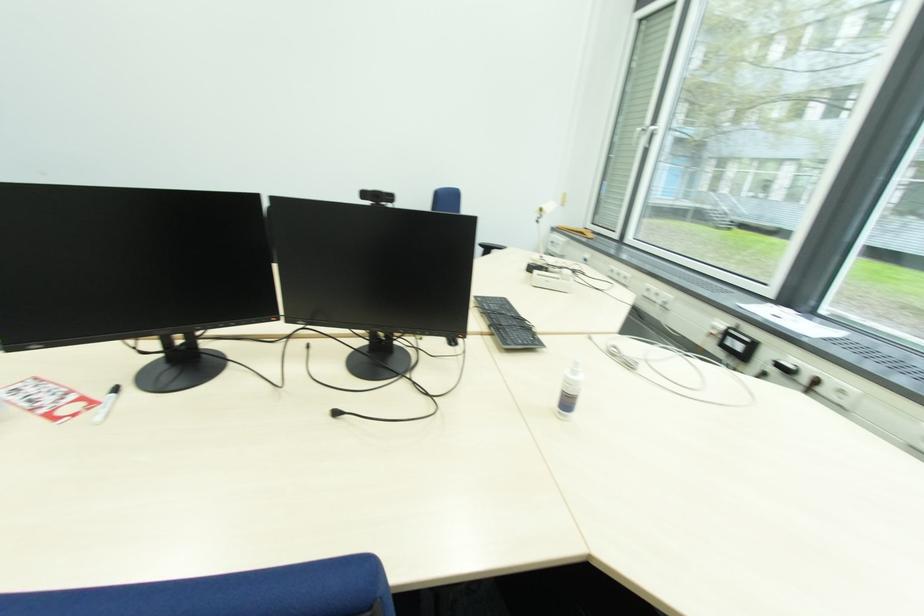
Identify the location of white window handle. Image resolution: width=924 pixels, height=616 pixels. (643, 137).